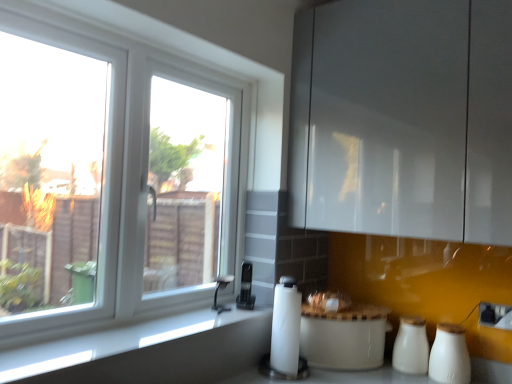
Question: From a real-world perspective, is smooth gray countertop at lower left on top of white plastic window at left?

Choices:
 (A) no
 (B) yes

Answer: (A)

Question: Can you confirm if smooth gray countertop at lower left is positioned to the left of white plastic window at left?

Choices:
 (A) yes
 (B) no

Answer: (B)

Question: Could you tell me if smooth gray countertop at lower left is facing white plastic window at left?

Choices:
 (A) yes
 (B) no

Answer: (B)

Question: Can white plastic window at left be found inside smooth gray countertop at lower left?

Choices:
 (A) no
 (B) yes

Answer: (A)

Question: Is smooth gray countertop at lower left next to white plastic window at left?

Choices:
 (A) yes
 (B) no

Answer: (B)

Question: Considering the relative positions of smooth gray countertop at lower left and white plastic window at left in the image provided, is smooth gray countertop at lower left behind white plastic window at left?

Choices:
 (A) yes
 (B) no

Answer: (B)

Question: Does satin nickel faucet at lower center have a larger size compared to white ceramic salt shaker at lower right, arranged as the first salt shaker when viewed from the front?

Choices:
 (A) no
 (B) yes

Answer: (A)

Question: Is satin nickel faucet at lower center completely or partially outside of white ceramic salt shaker at lower right, arranged as the first salt shaker when viewed from the front?

Choices:
 (A) no
 (B) yes

Answer: (B)

Question: Does satin nickel faucet at lower center have a greater height compared to white ceramic salt shaker at lower right, arranged as the first salt shaker when viewed from the front?

Choices:
 (A) no
 (B) yes

Answer: (A)

Question: Is satin nickel faucet at lower center looking in the opposite direction of white ceramic salt shaker at lower right, arranged as the first salt shaker when viewed from the front?

Choices:
 (A) no
 (B) yes

Answer: (A)

Question: Is satin nickel faucet at lower center thinner than white ceramic salt shaker at lower right, arranged as the first salt shaker when viewed from the front?

Choices:
 (A) no
 (B) yes

Answer: (B)

Question: Does satin nickel faucet at lower center have a smaller size compared to white ceramic salt shaker at lower right, positioned as the 2th salt shaker in back-to-front order?

Choices:
 (A) yes
 (B) no

Answer: (A)

Question: From a real-world perspective, is white ceramic salt shaker at lower right, positioned as the 2th salt shaker in back-to-front order, located higher than white plastic window at left?

Choices:
 (A) no
 (B) yes

Answer: (A)